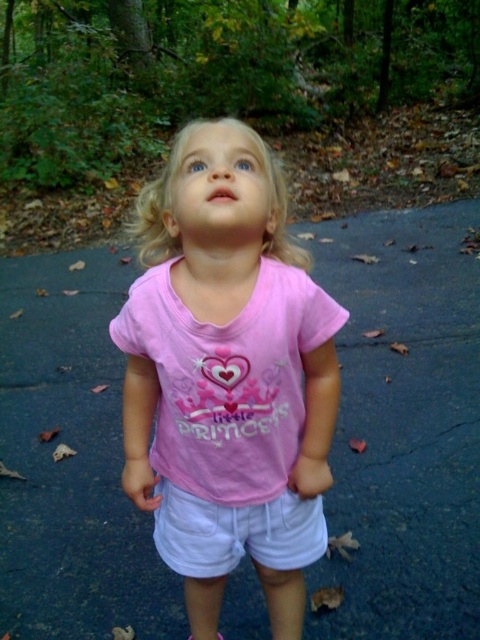
You are a drone operator trying to capture a photo of the child in the scene. The drone is currently hovering at point (404,426). To avoid capturing the asphalt pavement, which is located at the center of the image, where should you move the drone to get a clear shot of the child?

The point (404,426) corresponds to the matte asphalt pavement at center. To capture the child instead, move the drone away from the center towards the area where the child is standing.

You are a drone operator trying to capture the best aerial shot of the matte asphalt pavement at center. To do this, you need to hover directly above it. Given the coordinates provided in the description, where should you position the drone?

The matte asphalt pavement at center is located at point (x=404, y=426), so you should position the drone directly above those coordinates to capture the best aerial shot.